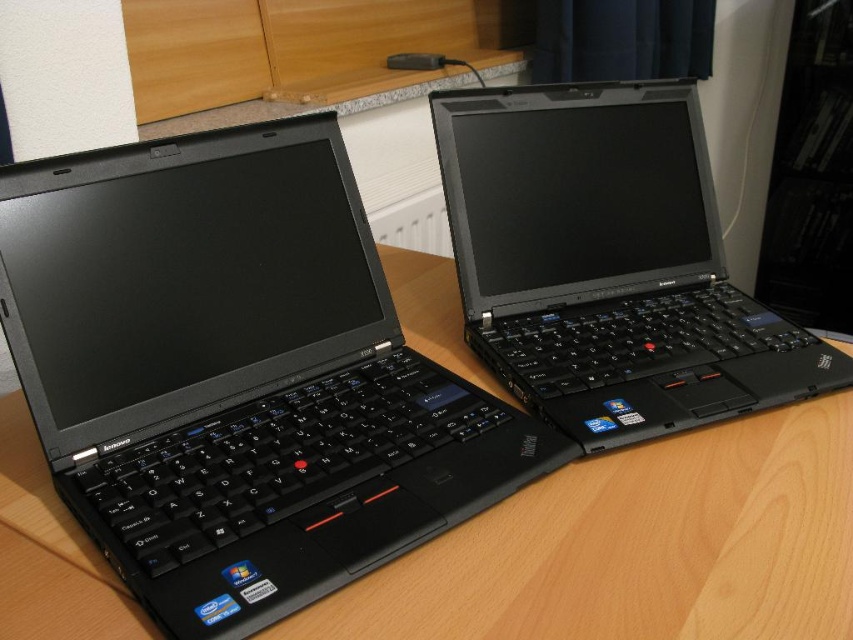
Does wooden table at center have a larger size compared to black matte laptop at upper right?

Yes.

Between point (462, 570) and point (691, 396), which one is positioned behind?

The point (691, 396) is behind.

Between point (799, 548) and point (460, 292), which one is positioned behind?

Point (460, 292)

You are a GUI agent. You are given a task and a screenshot of the screen. Output one action in this format:
    pyautogui.click(x=<x>, y=<y>)
    Task: Click on the wooden table at center
    
    Given the screenshot: What is the action you would take?
    pyautogui.click(x=637, y=547)